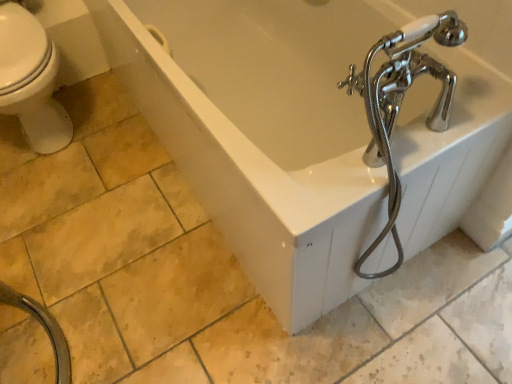
Locate an element on the screen. The height and width of the screenshot is (384, 512). vacant area situated below black rubber garden hose at lower left (from a real-world perspective) is located at coordinates (31, 340).